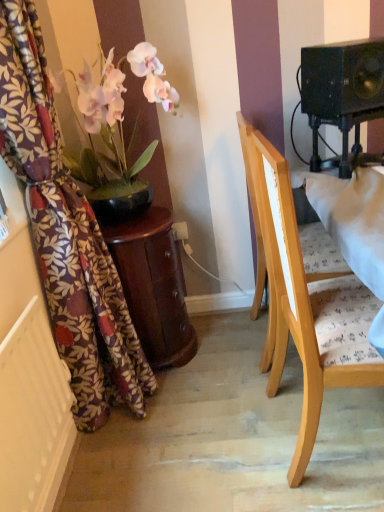
Question: Looking at the image, does mahogany wood side table at left seem bigger or smaller compared to black matte speaker at upper right?

Choices:
 (A) big
 (B) small

Answer: (A)

Question: From the image's perspective, is mahogany wood side table at left positioned above or below black matte speaker at upper right?

Choices:
 (A) above
 (B) below

Answer: (B)

Question: Which is farther from the mahogany wood side table at left?

Choices:
 (A) black matte speaker at upper right
 (B) floral fabric curtain at left
 (C) matte pink orchid at left
 (D) light wood chair at center
 (E) white textured radiator at lower left

Answer: (A)

Question: Estimate the real-world distances between objects in this image. Which object is farther from the floral fabric curtain at left?

Choices:
 (A) white textured radiator at lower left
 (B) black matte speaker at upper right
 (C) matte pink orchid at left
 (D) mahogany wood side table at left
 (E) light wood chair at center

Answer: (B)